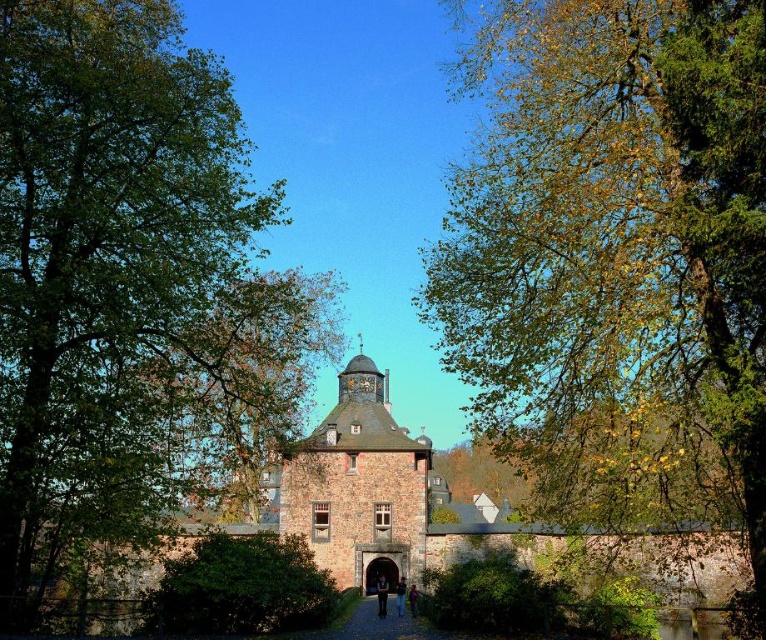
Question: Which point is closer to the camera?

Choices:
 (A) (377, 637)
 (B) (205, 99)

Answer: (A)

Question: Is the position of yellow-green leaves at upper right more distant than that of brown stone path at center?

Choices:
 (A) yes
 (B) no

Answer: (B)

Question: Can you confirm if yellow-green leaves at upper right is positioned below green leafy tree at center?

Choices:
 (A) yes
 (B) no

Answer: (B)

Question: Can you confirm if yellow-green leaves at upper right is wider than green leafy tree at upper left?

Choices:
 (A) no
 (B) yes

Answer: (B)

Question: Among these points, which one is farthest from the camera?

Choices:
 (A) pyautogui.click(x=345, y=618)
 (B) pyautogui.click(x=489, y=416)
 (C) pyautogui.click(x=23, y=390)
 (D) pyautogui.click(x=296, y=582)

Answer: (A)

Question: Which point is farther to the camera?

Choices:
 (A) green leafy tree at center
 (B) green leafy tree at upper left

Answer: (A)